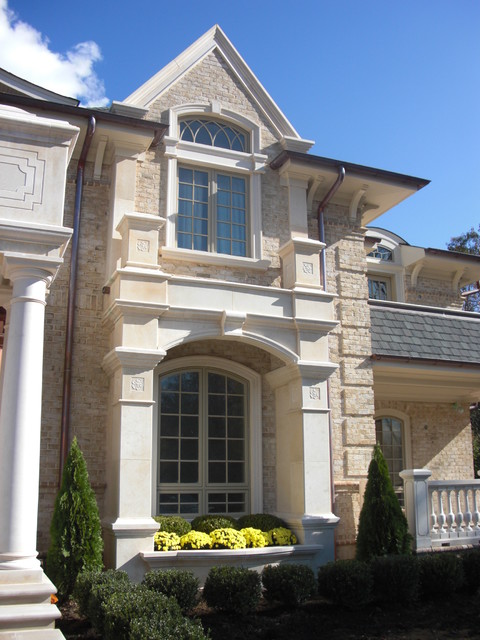
The width and height of the screenshot is (480, 640). In order to click on column in this screenshot , I will do `click(14, 540)`.